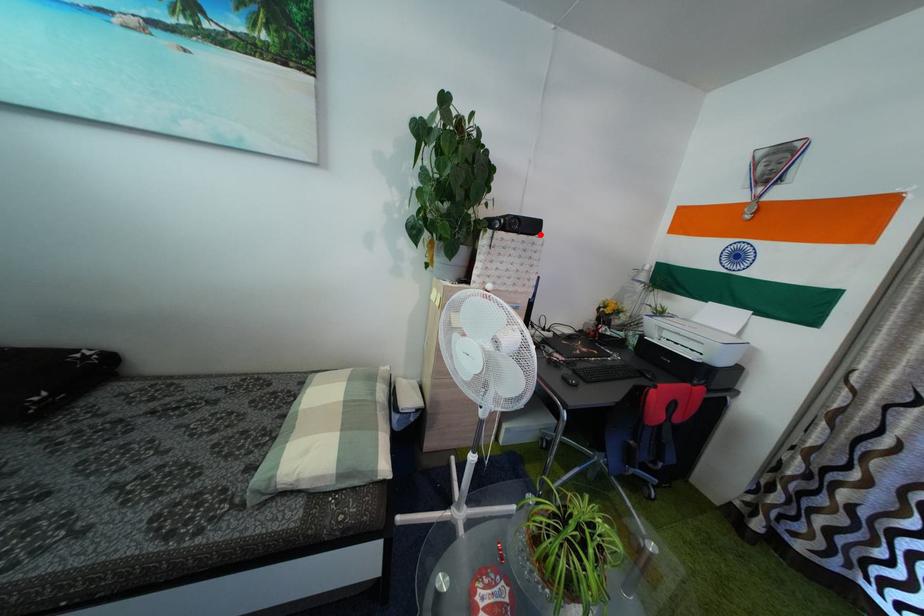
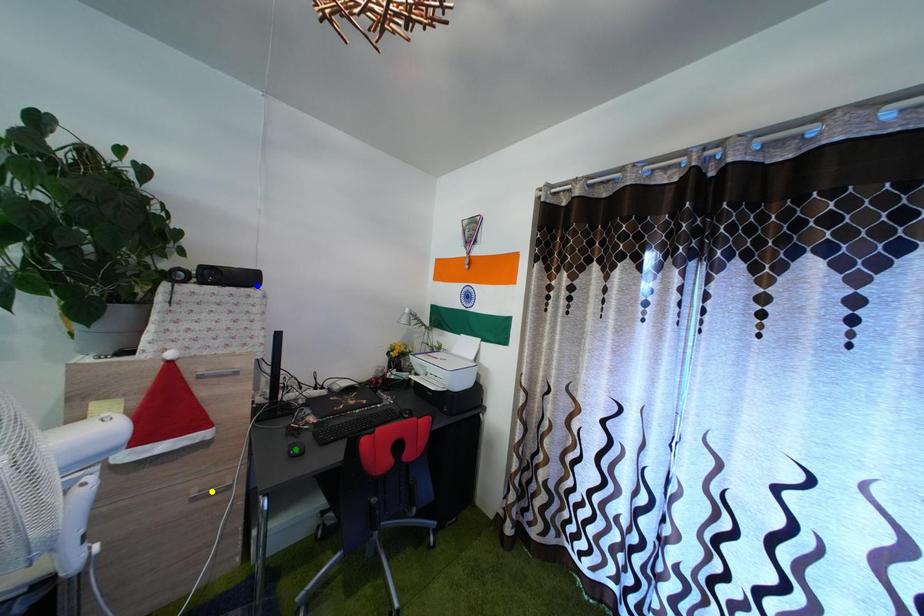
Question: I am providing you with two images of the same scene from different viewpoints. A red point is marked on the first image. You are given multiple points on the second image. Which spot in image 2 lines up with the point in image 1?

Choices:
 (A) yellow point
 (B) green point
 (C) blue point

Answer: (C)